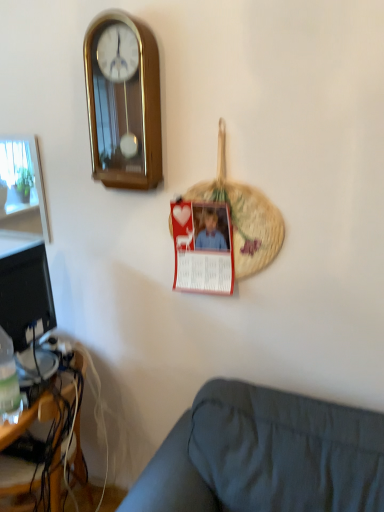
Question: From a real-world perspective, is gold polished wood wall clock at upper left below wooden desk at lower left?

Choices:
 (A) no
 (B) yes

Answer: (A)

Question: Does gold polished wood wall clock at upper left have a greater width compared to wooden desk at lower left?

Choices:
 (A) yes
 (B) no

Answer: (B)

Question: Is gold polished wood wall clock at upper left closer to the viewer compared to wooden desk at lower left?

Choices:
 (A) no
 (B) yes

Answer: (B)

Question: Is gold polished wood wall clock at upper left at the left side of wooden desk at lower left?

Choices:
 (A) no
 (B) yes

Answer: (A)

Question: From the image's perspective, would you say gold polished wood wall clock at upper left is positioned over wooden desk at lower left?

Choices:
 (A) no
 (B) yes

Answer: (B)

Question: Is gold polished wood wall clock at upper left positioned with its back to wooden desk at lower left?

Choices:
 (A) no
 (B) yes

Answer: (A)

Question: Does gold polished wood wall clock at upper left have a lesser height compared to translucent plastic bottle at lower left?

Choices:
 (A) yes
 (B) no

Answer: (B)

Question: Considering the relative sizes of gold polished wood wall clock at upper left and translucent plastic bottle at lower left in the image provided, is gold polished wood wall clock at upper left bigger than translucent plastic bottle at lower left?

Choices:
 (A) no
 (B) yes

Answer: (B)

Question: From a real-world perspective, does gold polished wood wall clock at upper left stand above translucent plastic bottle at lower left?

Choices:
 (A) yes
 (B) no

Answer: (A)

Question: Is gold polished wood wall clock at upper left thinner than translucent plastic bottle at lower left?

Choices:
 (A) yes
 (B) no

Answer: (B)

Question: Is gold polished wood wall clock at upper left to the left of translucent plastic bottle at lower left from the viewer's perspective?

Choices:
 (A) no
 (B) yes

Answer: (A)

Question: Can you confirm if gold polished wood wall clock at upper left is smaller than translucent plastic bottle at lower left?

Choices:
 (A) yes
 (B) no

Answer: (B)

Question: Does dark gray fabric couch at lower right have a larger size compared to gold polished wood wall clock at upper left?

Choices:
 (A) no
 (B) yes

Answer: (B)